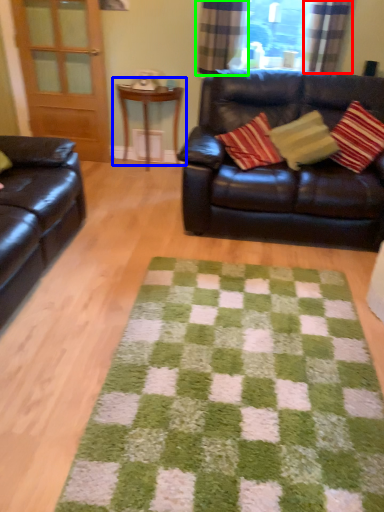
Question: Considering the real-world distances, which object is farthest from curtain (highlighted by a red box)? table (highlighted by a blue box) or curtain (highlighted by a green box)?

Choices:
 (A) table
 (B) curtain

Answer: (A)